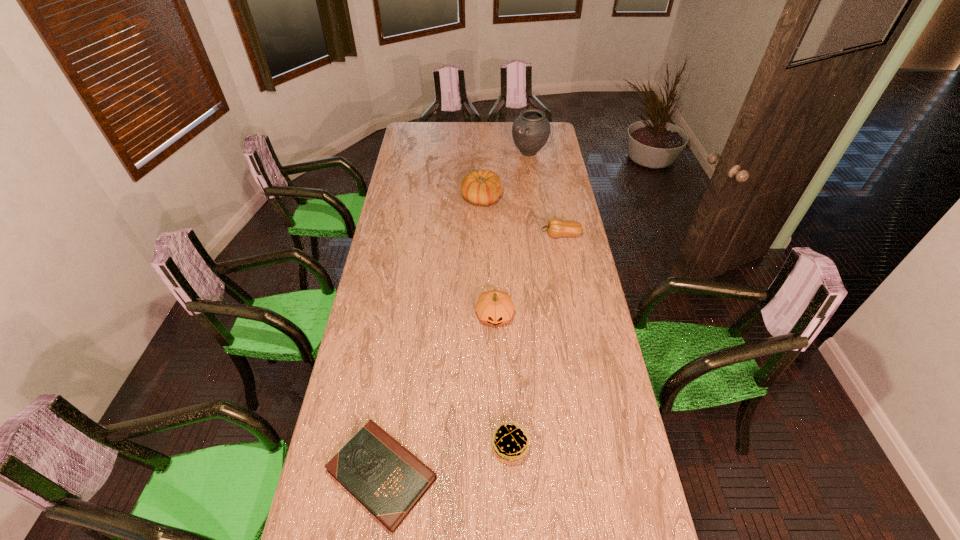
Locate an element on the screen. The image size is (960, 540). free space at the far edge of the desktop is located at coordinates (466, 123).

Locate an element on the screen. The height and width of the screenshot is (540, 960). free spot at the left edge of the desktop is located at coordinates (402, 267).

This screenshot has height=540, width=960. I want to click on vacant space at the right edge, so click(579, 322).

In order to click on free region at the far left corner of the desktop in this screenshot , I will do click(423, 134).

Identify the location of vacant space in between the farthest gourd and the Bible. The image size is (960, 540). (432, 336).

Identify the location of free spot between the fourth farthest object and the second farthest object. (489, 257).

You are a GUI agent. You are given a task and a screenshot of the screen. Output one action in this format:
    pyautogui.click(x=<x>, y=<y>)
    Task: Click on the vacant area that lies between the patty and the rightmost gourd
    
    Given the screenshot: What is the action you would take?
    pyautogui.click(x=536, y=341)

Identify the location of vacant space that's between the farthest object and the fifth nearest object. (506, 176).

I want to click on vacant area that lies between the third nearest object and the second nearest gourd, so click(x=528, y=275).

Locate an element on the screen. vacant point located between the urn and the farthest gourd is located at coordinates (506, 176).